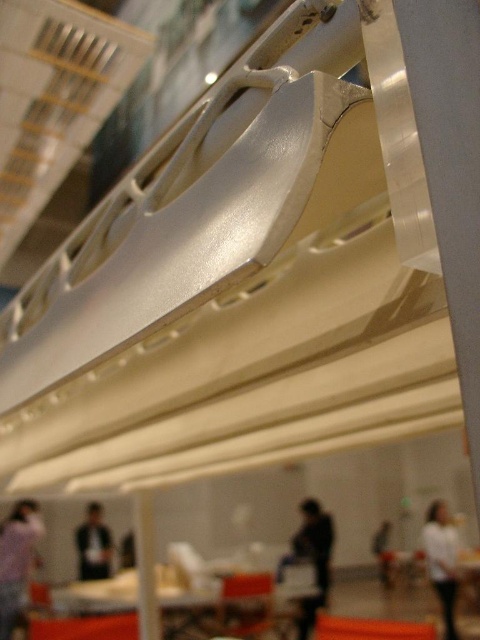
Question: Which object appears closest to the camera in this image?

Choices:
 (A) white matte shirt at lower right
 (B) dark clothing at center

Answer: (A)

Question: Which object is positioned farthest from the dark clothing at center?

Choices:
 (A) dark gray fabric jacket at lower left
 (B) white matte shirt at lower right
 (C) white matte person at lower right

Answer: (A)

Question: Is light purple shirt at lower left thinner than dark clothing at center?

Choices:
 (A) no
 (B) yes

Answer: (A)

Question: Is dark gray fabric jacket at lower left positioned in front of white matte person at lower right?

Choices:
 (A) no
 (B) yes

Answer: (B)

Question: Which object is the farthest from the dark clothing at center?

Choices:
 (A) light purple shirt at lower left
 (B) dark gray fabric jacket at lower left
 (C) white matte shirt at lower right

Answer: (A)

Question: Does light purple shirt at lower left have a greater width compared to dark clothing at center?

Choices:
 (A) yes
 (B) no

Answer: (A)